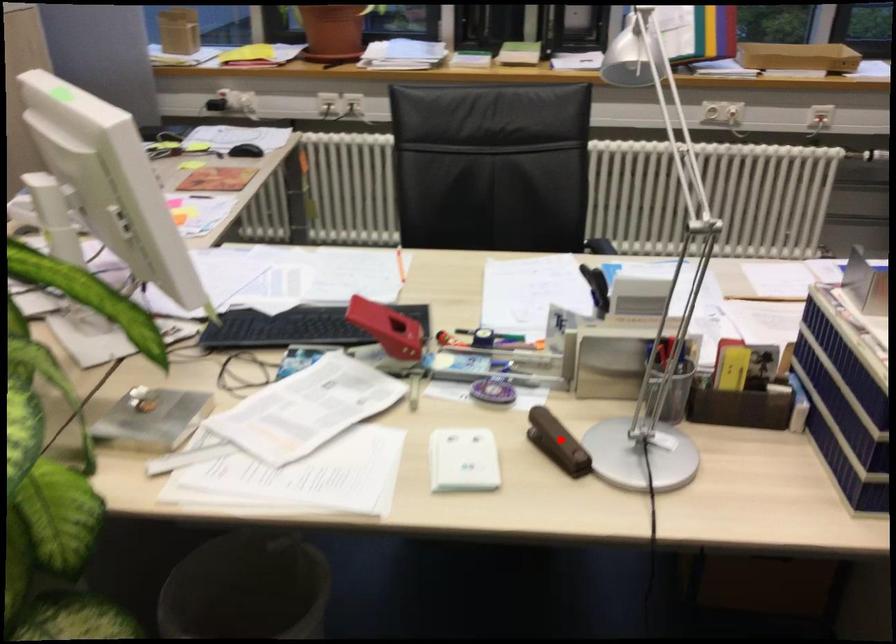
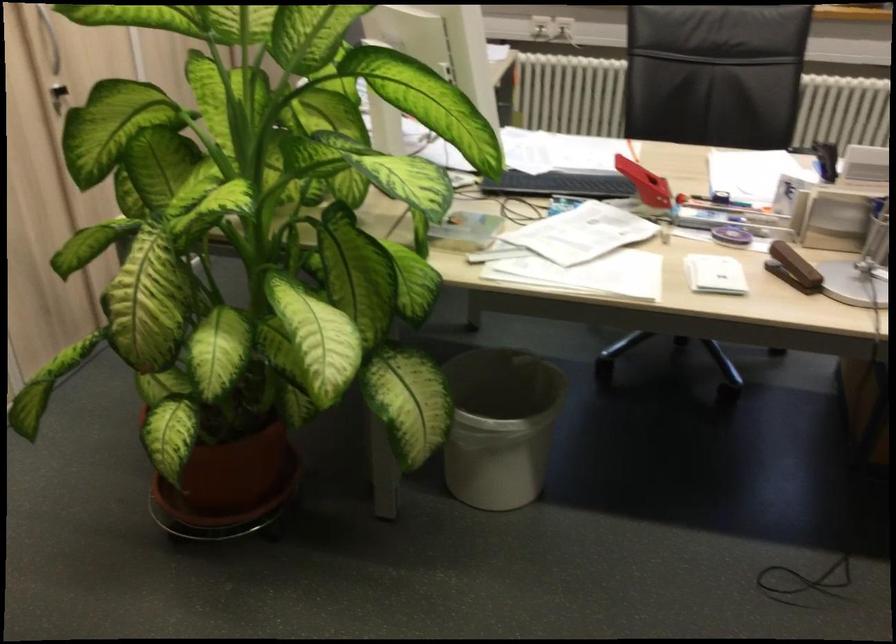
In the second image, find the point that corresponds to the highlighted location in the first image.

(793, 268)